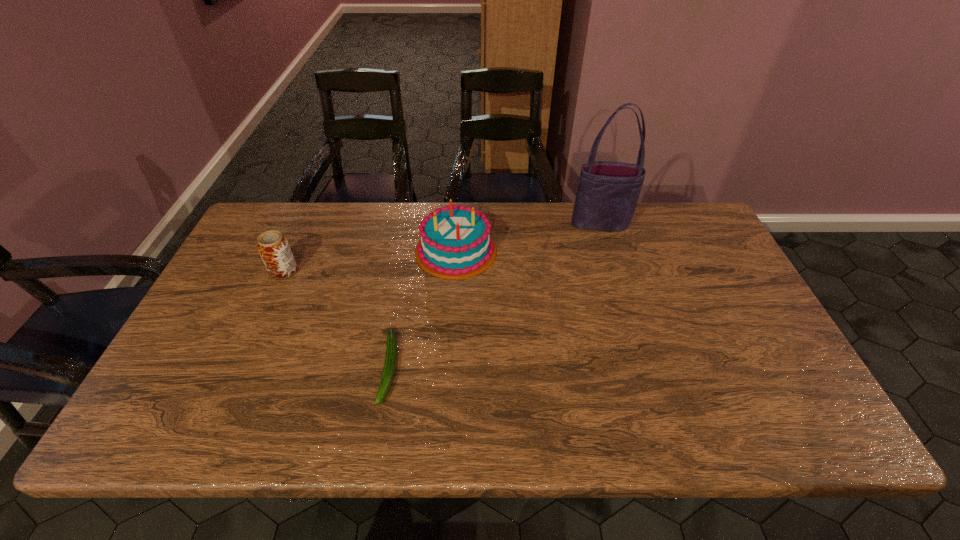
Identify the location of tote bag located at the far edge. (607, 195).

The height and width of the screenshot is (540, 960). In order to click on birthday cake situated at the far edge in this screenshot , I will do `click(456, 242)`.

You are a GUI agent. You are given a task and a screenshot of the screen. Output one action in this format:
    pyautogui.click(x=<x>, y=<y>)
    Task: Click on the object that is at the near edge
    Image resolution: width=960 pixels, height=540 pixels.
    Given the screenshot: What is the action you would take?
    pyautogui.click(x=391, y=342)

The height and width of the screenshot is (540, 960). Identify the location of object that is at the left edge. (273, 247).

The width and height of the screenshot is (960, 540). In the image, there is a desktop. What are the coordinates of `free space at the far edge` in the screenshot? It's located at (542, 220).

Image resolution: width=960 pixels, height=540 pixels. In the image, there is a desktop. Identify the location of free region at the near edge. (580, 422).

Locate an element on the screen. free spot at the left edge of the desktop is located at coordinates (236, 266).

Where is `blank space at the near left corner of the desktop`? blank space at the near left corner of the desktop is located at coordinates (206, 432).

Where is `empty space between the zucchini and the second shortest object`? empty space between the zucchini and the second shortest object is located at coordinates (337, 320).

Where is `vacant space that's between the tallest object and the nearest object`? The width and height of the screenshot is (960, 540). vacant space that's between the tallest object and the nearest object is located at coordinates (494, 296).